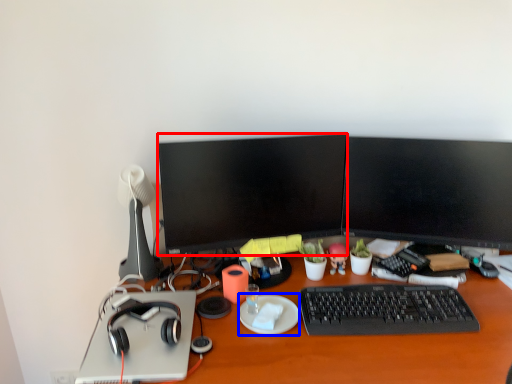
Question: Among these objects, which one is farthest to the camera, television (highlighted by a red box) or plate (highlighted by a blue box)?

Choices:
 (A) television
 (B) plate

Answer: (A)